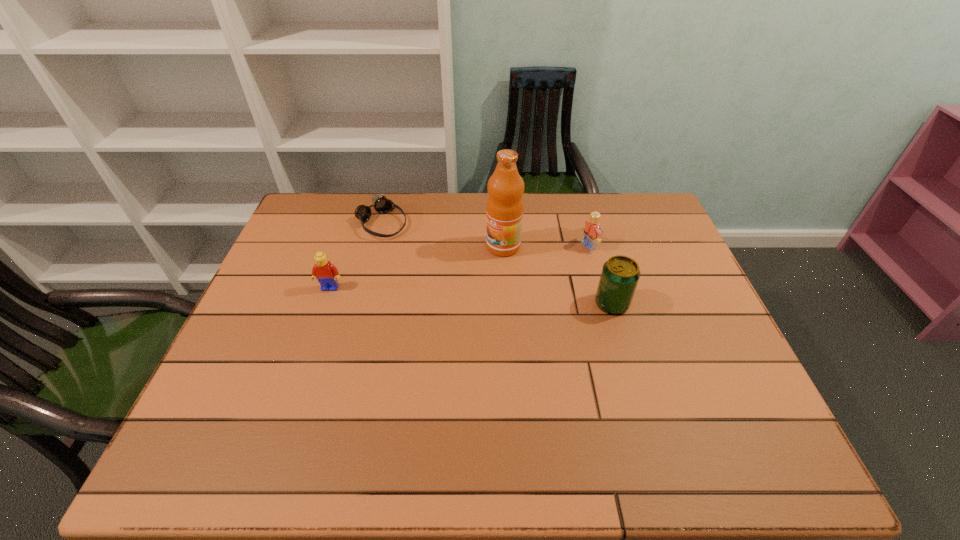
Where is `vacant area at the near edge of the desktop`? This screenshot has width=960, height=540. vacant area at the near edge of the desktop is located at coordinates (516, 414).

In the image, there is a desktop. Where is `vacant space at the left edge`? This screenshot has width=960, height=540. vacant space at the left edge is located at coordinates (240, 359).

Locate an element on the screen. vacant region at the right edge of the desktop is located at coordinates (678, 268).

The height and width of the screenshot is (540, 960). In order to click on blank space at the far left corner in this screenshot , I will do `click(342, 206)`.

The height and width of the screenshot is (540, 960). In the image, there is a desktop. Find the location of `vacant space at the far right corner`. vacant space at the far right corner is located at coordinates (641, 194).

Locate an element on the screen. The image size is (960, 540). free space that is in between the right Lego and the nearer Lego is located at coordinates point(460,267).

At what (x,y) coordinates should I click in order to perform the action: click on empty space that is in between the nearer Lego and the third object from right to left. Please return your answer as a coordinate pair (x, y). Image resolution: width=960 pixels, height=540 pixels. Looking at the image, I should click on (417, 267).

Where is `free space between the goggles and the tallest object`? Image resolution: width=960 pixels, height=540 pixels. free space between the goggles and the tallest object is located at coordinates (443, 234).

The height and width of the screenshot is (540, 960). Find the location of `free spot between the nearer Lego and the tallest object`. free spot between the nearer Lego and the tallest object is located at coordinates (417, 267).

Locate an element on the screen. free space between the third object from left to right and the beer can is located at coordinates (558, 275).